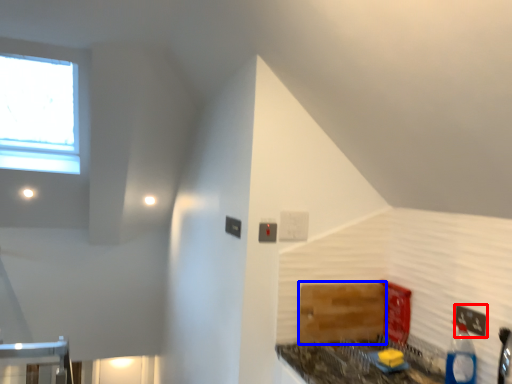
Question: Which of the following is the closest to the observer, electric outlet (highlighted by a red box) or cabinetry (highlighted by a blue box)?

Choices:
 (A) electric outlet
 (B) cabinetry

Answer: (A)